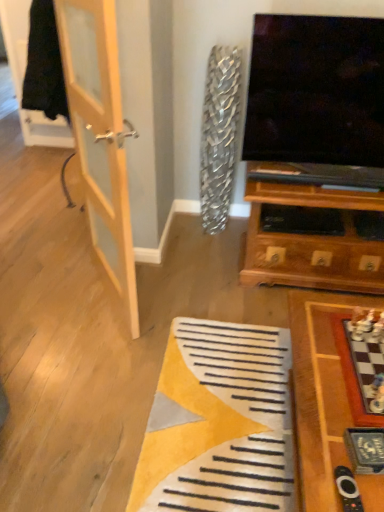
The width and height of the screenshot is (384, 512). Identify the location of vacant region in front of light wood door at left. (93, 355).